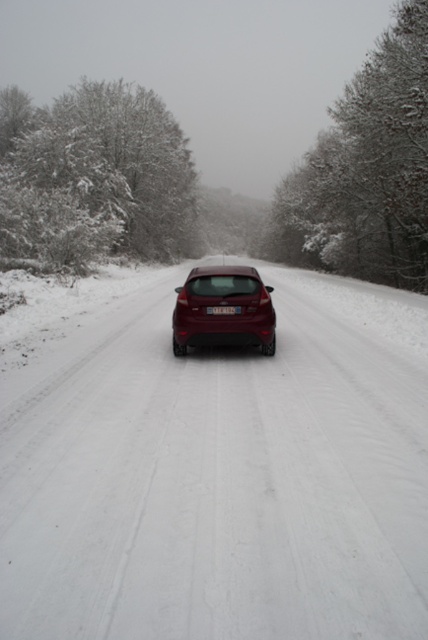
Question: Is snow-covered trees at upper center to the left of white plastic license plate at center from the viewer's perspective?

Choices:
 (A) yes
 (B) no

Answer: (B)

Question: Which point is farther to the camera?

Choices:
 (A) (240, 310)
 (B) (264, 310)

Answer: (B)

Question: Does white powdery snow at center appear on the right side of snow-covered trees at upper center?

Choices:
 (A) no
 (B) yes

Answer: (A)

Question: Observing the image, what is the correct spatial positioning of snow-covered tree at left in reference to snow-covered trees at upper center?

Choices:
 (A) left
 (B) right

Answer: (A)

Question: Which point appears farthest from the camera in this image?

Choices:
 (A) (335, 227)
 (B) (253, 317)
 (C) (196, 177)

Answer: (C)

Question: Based on their relative distances, which object is farther from the white plastic license plate at center?

Choices:
 (A) white powdery snow at center
 (B) glossy metallic hatchback at center

Answer: (A)